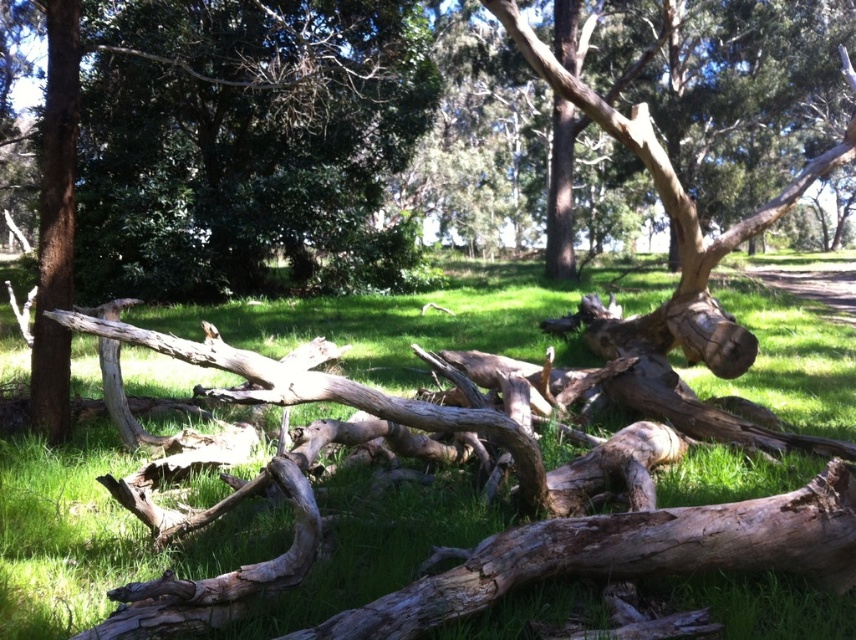
Is brown rough wood at center thinner than brown rough tree trunk at left?

In fact, brown rough wood at center might be wider than brown rough tree trunk at left.

Is brown rough wood at center to the left of brown rough tree trunk at left from the viewer's perspective?

No, brown rough wood at center is not to the left of brown rough tree trunk at left.

Find the location of a particular element. The width and height of the screenshot is (856, 640). brown rough wood at center is located at coordinates (675, 218).

Find the location of a particular element. The height and width of the screenshot is (640, 856). brown rough wood at center is located at coordinates (675, 218).

Between drab brown log at center and smooth brown tree trunk at center, which one has more height?

With more height is drab brown log at center.

Measure the distance between point (687, 291) and camera.

Point (687, 291) and camera are 5.06 meters apart.

Where is `drab brown log at center`? Image resolution: width=856 pixels, height=640 pixels. drab brown log at center is located at coordinates (675, 211).

Locate an element on the screen. Image resolution: width=856 pixels, height=640 pixels. drab brown log at center is located at coordinates (675, 211).

Describe the element at coordinates (675, 211) in the screenshot. The width and height of the screenshot is (856, 640). I see `drab brown log at center` at that location.

This screenshot has width=856, height=640. I want to click on drab brown log at center, so click(x=675, y=211).